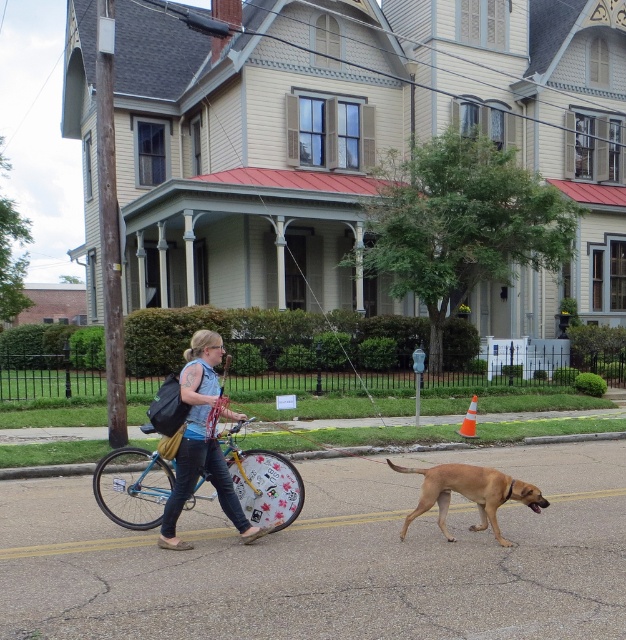
Question: Among these points, which one is farthest from the camera?

Choices:
 (A) (456, 483)
 (B) (156, 451)
 (C) (185, 372)

Answer: (B)

Question: Which is nearer to the blue metallic bicycle at center?

Choices:
 (A) golden brown fur at center
 (B) denim jacket at center

Answer: (B)

Question: Observing the image, what is the correct spatial positioning of denim jacket at center in reference to golden brown fur at center?

Choices:
 (A) above
 (B) below

Answer: (A)

Question: Is blue metallic bicycle at center positioned before golden brown fur at center?

Choices:
 (A) no
 (B) yes

Answer: (B)

Question: Is blue metallic bicycle at center to the right of golden brown fur at center from the viewer's perspective?

Choices:
 (A) yes
 (B) no

Answer: (B)

Question: Which point is farther from the camera taking this photo?

Choices:
 (A) (463, 476)
 (B) (289, 515)
 (C) (218, 461)

Answer: (B)